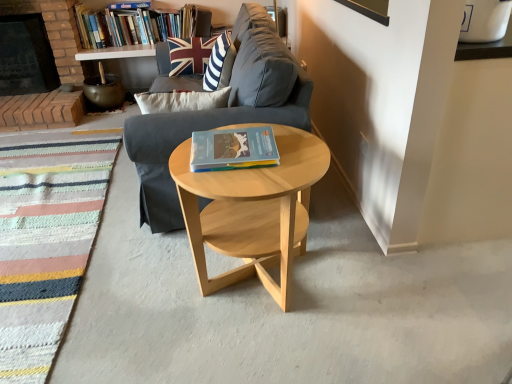
The height and width of the screenshot is (384, 512). In order to click on vacant space that is in between gray fabric couch at center and natural wood side table at center in this screenshot , I will do `click(169, 278)`.